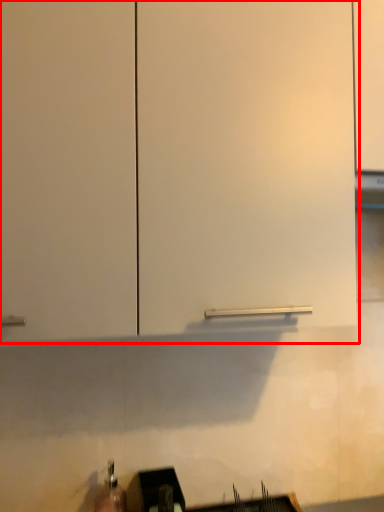
Question: From the image's perspective, where is cabinetry (annotated by the red box) located in relation to sink in the image?

Choices:
 (A) below
 (B) above

Answer: (B)